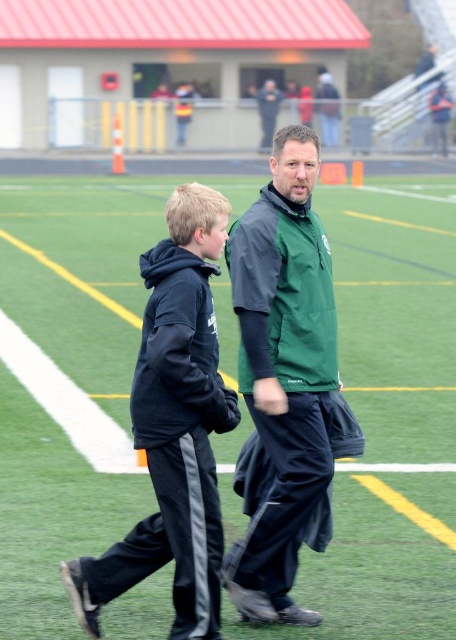
Based on the photo, you are a photographer standing at the edge of the football field. You need to capture a photo where the green matte track at center is visible above the black fleece jacket at center. Based on the scene, can you confirm if this arrangement is possible?

Yes, the green matte track at center is located above the black fleece jacket at center, so this arrangement is possible.

You are a photographer standing at the edge of the football field. You want to capture a photo of the green matte track at center and the green matte jacket at center. Which object should you zoom in on to ensure both are clearly visible in the photo?

The green matte track at center is wider than the green matte jacket at center, so you should zoom in on the green matte jacket at center to ensure both are clearly visible in the photo.